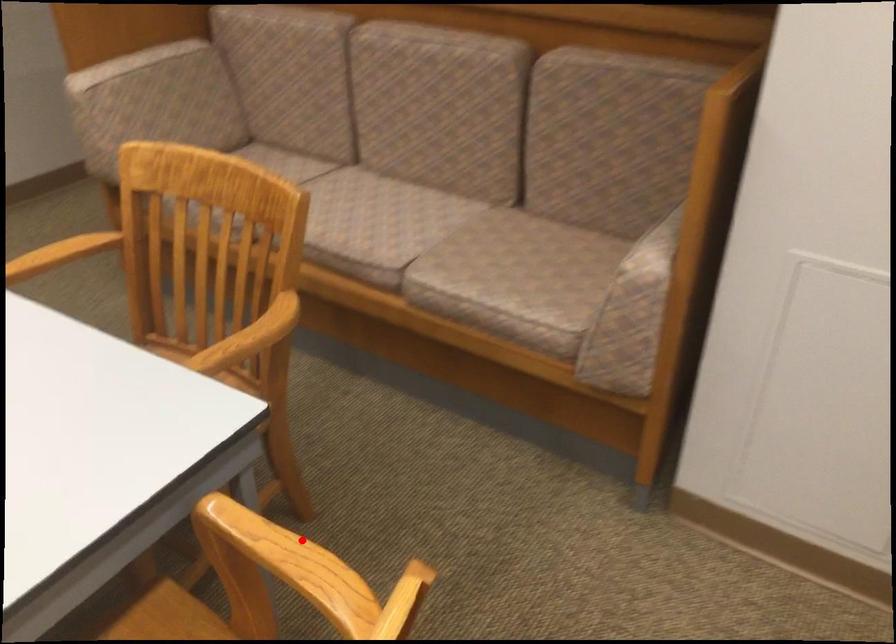
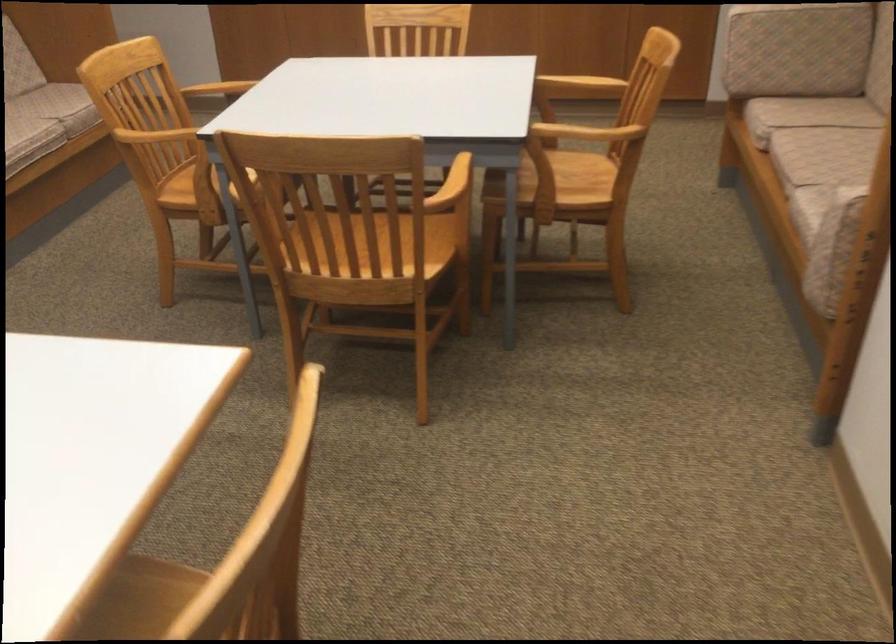
Question: I am providing you with two images of the same scene from different viewpoints. A red point is marked on the first image. Can you still see the location of the red point in image 2?

Choices:
 (A) Yes
 (B) No

Answer: (A)